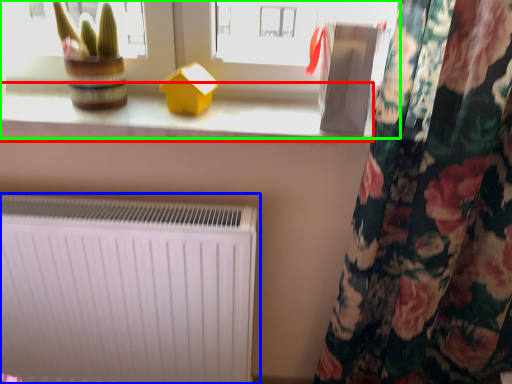
Question: Which object is positioned farthest from window sill (highlighted by a red box)? Select from radiator (highlighted by a blue box) and window (highlighted by a green box).

Choices:
 (A) radiator
 (B) window

Answer: (A)